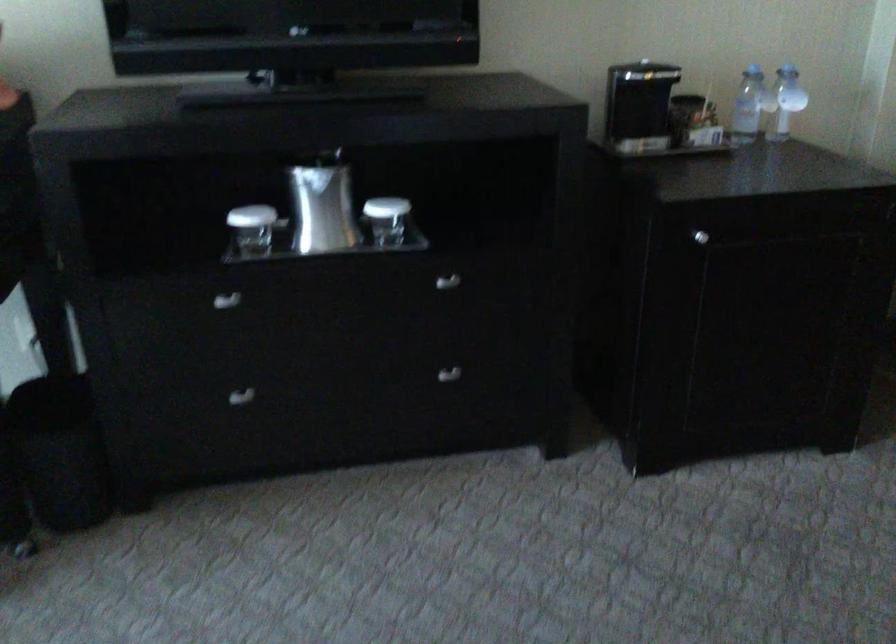
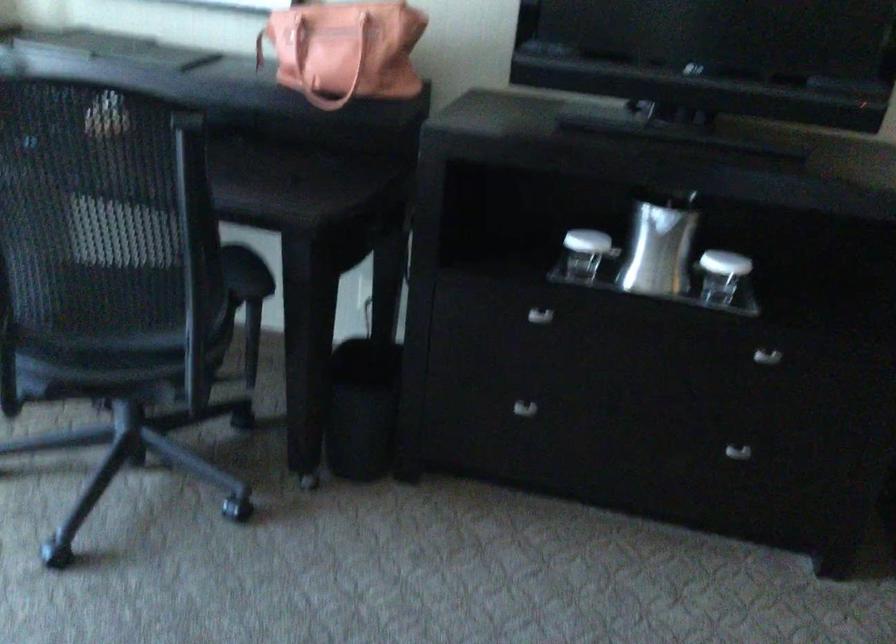
Locate, in the second image, the point that corresponds to (222,299) in the first image.

(539, 316)